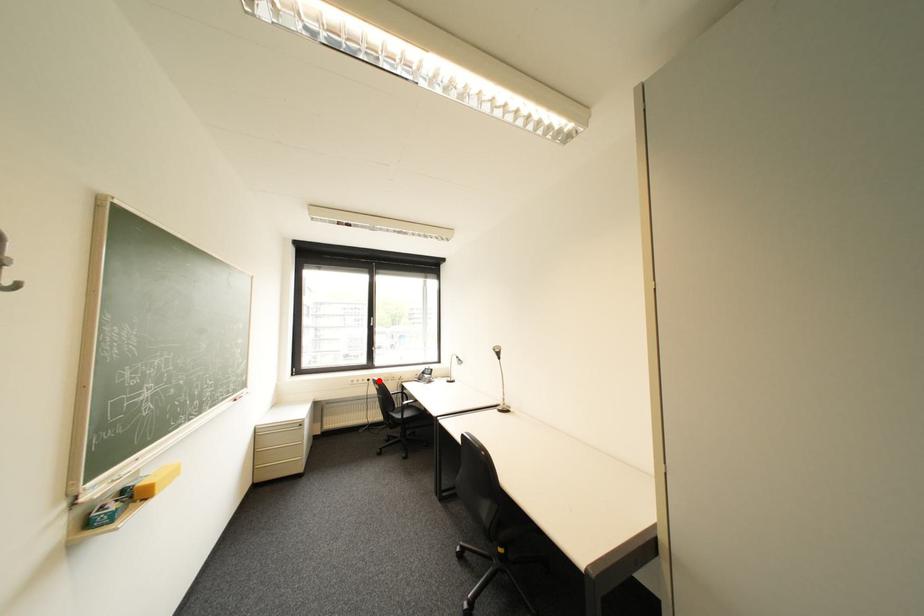
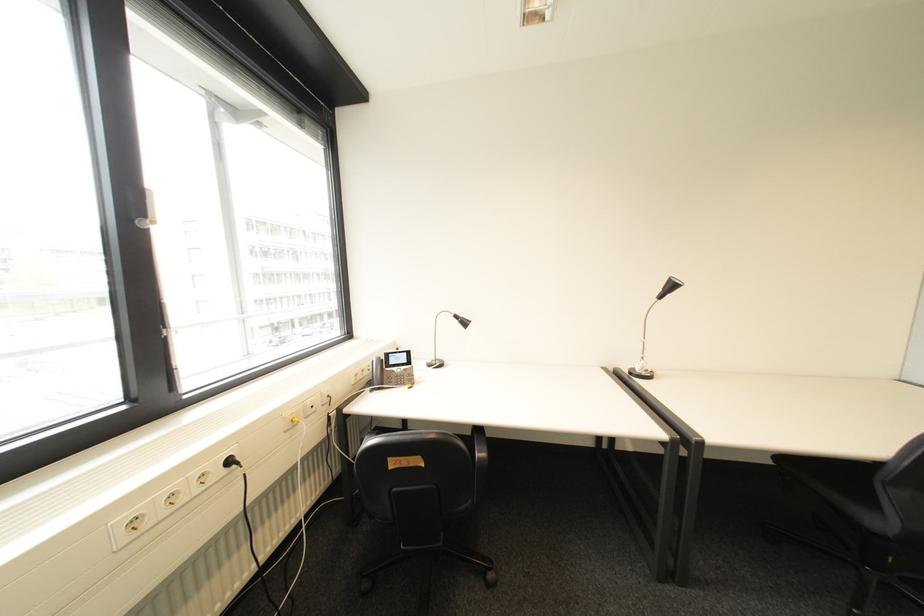
In the second image, find the point that corresponds to the highlighted location in the first image.

(239, 463)